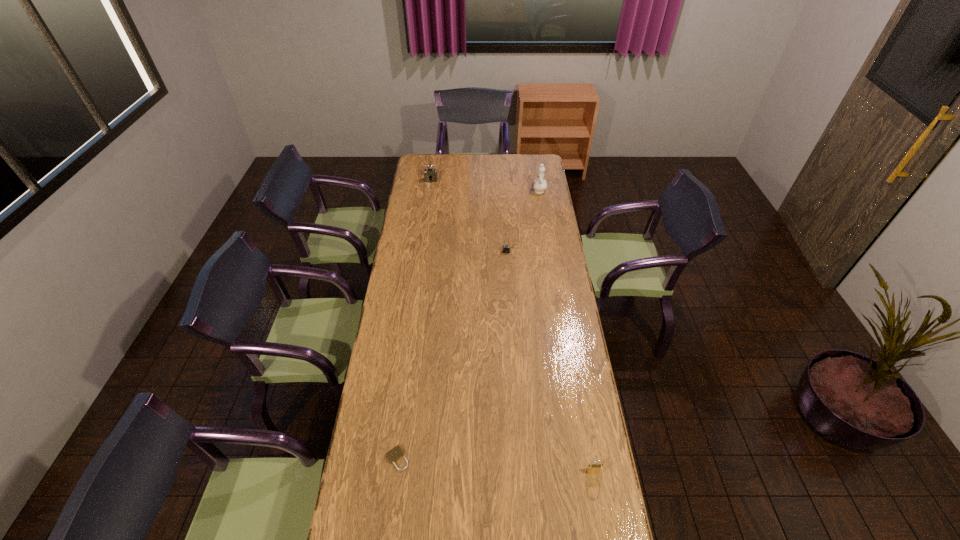
This screenshot has height=540, width=960. Find the location of `vacant region located 0.100m at the spout of the chinaware`. vacant region located 0.100m at the spout of the chinaware is located at coordinates (537, 175).

The height and width of the screenshot is (540, 960). Identify the location of blank space located 0.180m at the front of the farthest padlock near the keyhole. (428, 200).

The width and height of the screenshot is (960, 540). Identify the location of free space located on the shackle of the third nearest object. (509, 292).

You are a GUI agent. You are given a task and a screenshot of the screen. Output one action in this format:
    pyautogui.click(x=<x>, y=<y>)
    Task: Click on the free space located 0.170m on the front-facing side of the rightmost padlock
    The height and width of the screenshot is (540, 960).
    Given the screenshot: What is the action you would take?
    pyautogui.click(x=605, y=531)

Locate an element on the screen. vacant region located 0.070m on the front of the shortest padlock is located at coordinates (393, 493).

Locate an element on the screen. chinaware that is positioned at the right edge is located at coordinates (539, 184).

Locate an element on the screen. This screenshot has width=960, height=540. padlock located in the right edge section of the desktop is located at coordinates (592, 468).

I want to click on vacant space at the far edge of the desktop, so click(506, 157).

You are a GUI agent. You are given a task and a screenshot of the screen. Output one action in this format:
    pyautogui.click(x=<x>, y=<y>)
    Task: Click on the free region at the left edge of the desktop
    
    Given the screenshot: What is the action you would take?
    pyautogui.click(x=400, y=427)

In the image, there is a desktop. What are the coordinates of `vacant space at the right edge` in the screenshot? It's located at click(564, 389).